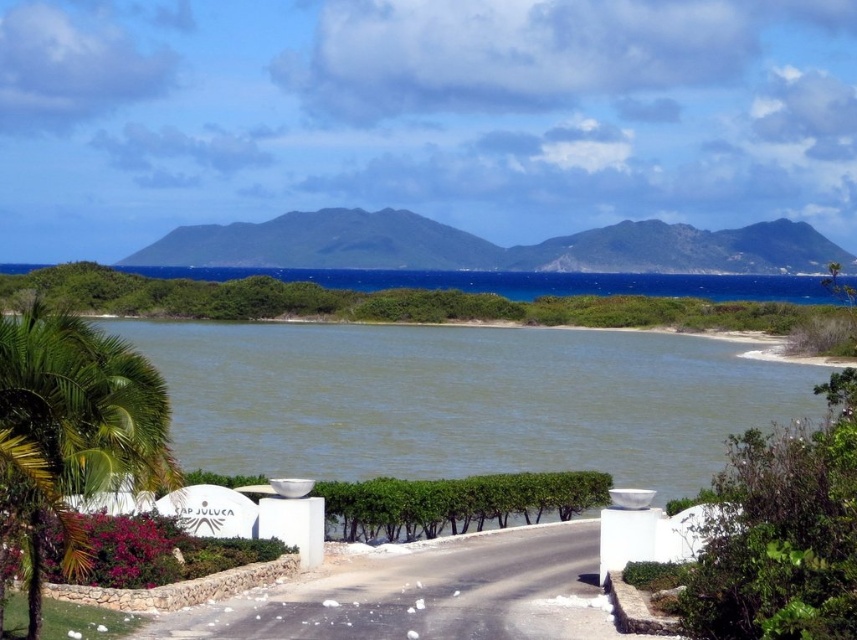
Is green water at center above green leafy palm tree at lower left?

Yes, green water at center is above green leafy palm tree at lower left.

Who is higher up, green water at center or green leafy palm tree at lower left?

green water at center

Is point (622, 364) positioned before point (66, 445)?

No, it is not.

Where is `green water at center`? green water at center is located at coordinates (464, 400).